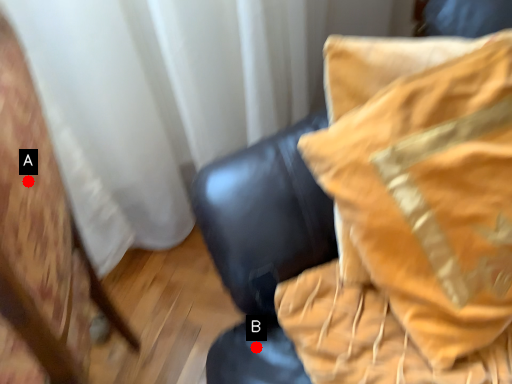
Question: Two points are circled on the image, labeled by A and B beside each circle. Which point is closer to the camera taking this photo?

Choices:
 (A) A is closer
 (B) B is closer

Answer: (A)